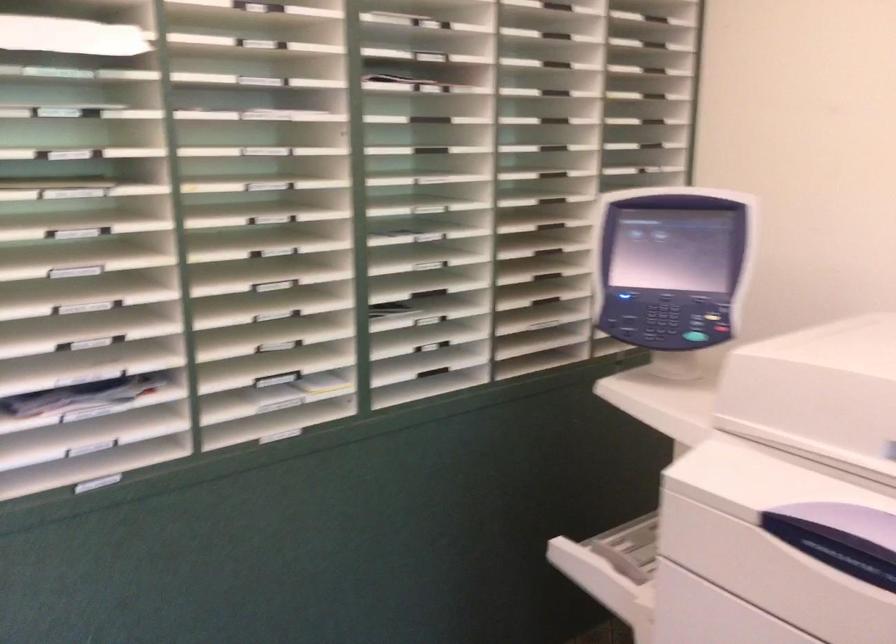
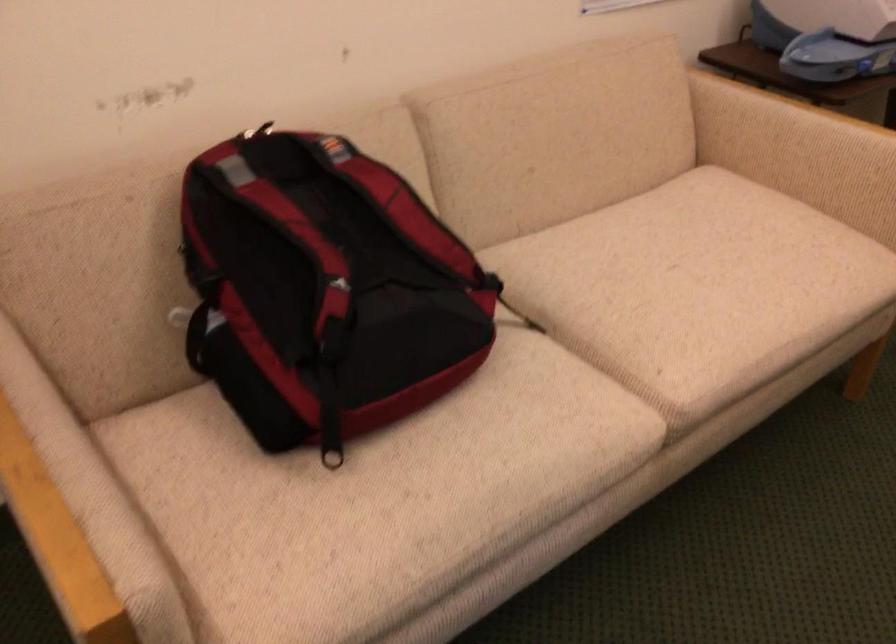
In a continuous first-person perspective shot, in which direction is the camera moving?

The movement direction of the cameraman is left, forward.